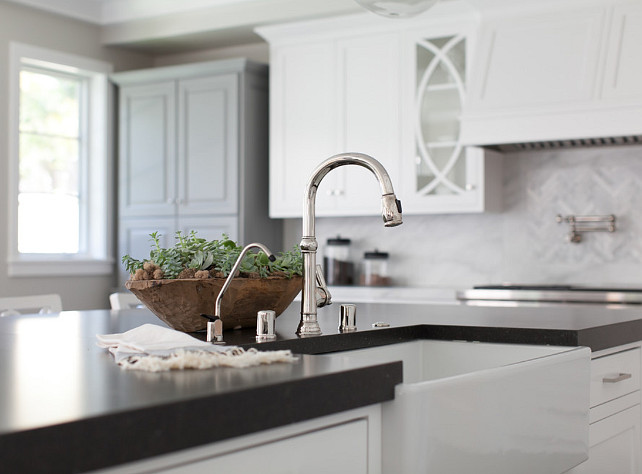
Locate an element on the screen. Image resolution: width=642 pixels, height=474 pixels. cupboard doors is located at coordinates (150, 138), (205, 139), (144, 249), (194, 230), (306, 129), (393, 102), (566, 90), (619, 98), (618, 438).